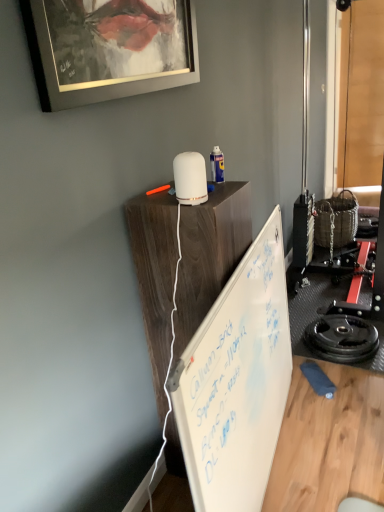
What is the approximate height of whiteboard at center?

whiteboard at center is 2.05 inches tall.

The image size is (384, 512). I want to click on whiteboard at center, so click(x=237, y=382).

Is whiteboard at center far away from black rubber weight plate at lower right?

Actually, whiteboard at center and black rubber weight plate at lower right are a little close together.

Is whiteboard at center further to the viewer compared to black rubber weight plate at lower right?

No, whiteboard at center is closer to the viewer.

Does whiteboard at center have a lesser height compared to black rubber weight plate at lower right?

Yes.

From a real-world perspective, is whiteboard at center over black rubber weight plate at lower right?

No, from a real-world perspective, whiteboard at center is not above black rubber weight plate at lower right.

From a real-world perspective, is white matte wood table at upper center located beneath metallic silver picture frame at upper left?

Yes, from a real-world perspective, white matte wood table at upper center is beneath metallic silver picture frame at upper left.

From the picture: From the image's perspective, between white matte wood table at upper center and metallic silver picture frame at upper left, which one is located above?

metallic silver picture frame at upper left appears higher in the image.

Is white matte wood table at upper center far from metallic silver picture frame at upper left?

No.

Considering the sizes of objects white matte wood table at upper center and metallic silver picture frame at upper left in the image provided, who is wider, white matte wood table at upper center or metallic silver picture frame at upper left?

white matte wood table at upper center.

Is white matte diffuser at upper center aimed at whiteboard at center?

No, white matte diffuser at upper center is not oriented towards whiteboard at center.

The image size is (384, 512). What are the coordinates of `appliance that is on the left side of whiteboard at center` in the screenshot? It's located at (190, 178).

From a real-world perspective, is white matte diffuser at upper center under whiteboard at center?

Incorrect, from a real-world perspective, white matte diffuser at upper center is higher than whiteboard at center.

Is metallic silver picture frame at upper left oriented away from white matte wood table at upper center?

That's not correct — metallic silver picture frame at upper left is not looking away from white matte wood table at upper center.

Considering the sizes of objects metallic silver picture frame at upper left and white matte wood table at upper center in the image provided, who is thinner, metallic silver picture frame at upper left or white matte wood table at upper center?

metallic silver picture frame at upper left.

Between metallic silver picture frame at upper left and white matte wood table at upper center, which one is positioned in front?

metallic silver picture frame at upper left is in front.

Which object is positioned more to the right, metallic silver picture frame at upper left or white matte wood table at upper center?

From the viewer's perspective, white matte wood table at upper center appears more on the right side.

Looking at the image, does whiteboard at center seem bigger or smaller compared to white matte wood table at upper center?

Considering their sizes, whiteboard at center takes up more space than white matte wood table at upper center.

Are whiteboard at center and white matte wood table at upper center beside each other?

No, whiteboard at center is not with white matte wood table at upper center.

Is whiteboard at center surrounding white matte wood table at upper center?

Actually, white matte wood table at upper center is outside whiteboard at center.

In terms of height, does whiteboard at center look taller or shorter compared to white matte wood table at upper center?

Clearly, whiteboard at center is shorter compared to white matte wood table at upper center.

Considering the relative sizes of black rubber weight plate at lower right and white matte diffuser at upper center in the image provided, is black rubber weight plate at lower right bigger than white matte diffuser at upper center?

Indeed, black rubber weight plate at lower right has a larger size compared to white matte diffuser at upper center.

Are black rubber weight plate at lower right and white matte diffuser at upper center making contact?

black rubber weight plate at lower right and white matte diffuser at upper center are not in contact.

Is black rubber weight plate at lower right turned away from white matte diffuser at upper center?

That's not correct — black rubber weight plate at lower right is not looking away from white matte diffuser at upper center.

Is white matte wood table at upper center facing towards black rubber weight plate at lower right?

No, white matte wood table at upper center is not turned towards black rubber weight plate at lower right.

Can you tell me how much white matte wood table at upper center and black rubber weight plate at lower right differ in facing direction?

The angular difference between white matte wood table at upper center and black rubber weight plate at lower right is 1.91 degrees.

Which is closer, (248, 197) or (346, 358)?

Point (248, 197) appears to be closer to the viewer than point (346, 358).

Is white matte wood table at upper center not close to black rubber weight plate at lower right?

Indeed, white matte wood table at upper center is not near black rubber weight plate at lower right.

Locate an element on the screen. Image resolution: width=384 pixels, height=512 pixels. wheel on the left of whiteboard at center is located at coordinates (342, 338).

I want to click on table located behind the metallic silver picture frame at upper left, so click(209, 254).

From the image, which object appears to be farther from black rubber weight plate at lower right, white matte wood table at upper center or white matte diffuser at upper center?

The object further to black rubber weight plate at lower right is white matte diffuser at upper center.

Considering their positions, is white matte diffuser at upper center positioned further to black rubber weight plate at lower right than metallic silver picture frame at upper left?

The object further to black rubber weight plate at lower right is metallic silver picture frame at upper left.

Based on the photo, when comparing their distances from white matte wood table at upper center, does white matte diffuser at upper center or whiteboard at center seem closer?

Among the two, whiteboard at center is located nearer to white matte wood table at upper center.

From the image, which object appears to be farther from white matte diffuser at upper center, white matte wood table at upper center or whiteboard at center?

whiteboard at center is positioned further to the anchor white matte diffuser at upper center.

Which object lies further to the anchor point black rubber weight plate at lower right, white matte wood table at upper center or whiteboard at center?

Among the two, white matte wood table at upper center is located further to black rubber weight plate at lower right.

Based on their spatial positions, is white matte wood table at upper center or white matte diffuser at upper center closer to whiteboard at center?

Among the two, white matte wood table at upper center is located nearer to whiteboard at center.

From the image, which object appears to be farther from metallic silver picture frame at upper left, white matte wood table at upper center or black rubber weight plate at lower right?

Based on the image, black rubber weight plate at lower right appears to be further to metallic silver picture frame at upper left.

In the scene shown: Based on their spatial positions, is black rubber weight plate at lower right or white matte wood table at upper center further from metallic silver picture frame at upper left?

The object further to metallic silver picture frame at upper left is black rubber weight plate at lower right.

Locate an element on the screen. wheel between white matte wood table at upper center and whiteboard at center in the horizontal direction is located at coordinates (342, 338).

Locate an element on the screen. Image resolution: width=384 pixels, height=512 pixels. table between metallic silver picture frame at upper left and whiteboard at center in the horizontal direction is located at coordinates (209, 254).

Locate an element on the screen. appliance that lies between metallic silver picture frame at upper left and white matte wood table at upper center from top to bottom is located at coordinates (190, 178).

At what (x,y) coordinates should I click in order to perform the action: click on appliance between metallic silver picture frame at upper left and black rubber weight plate at lower right along the z-axis. Please return your answer as a coordinate pair (x, y). This screenshot has width=384, height=512. Looking at the image, I should click on tap(190, 178).